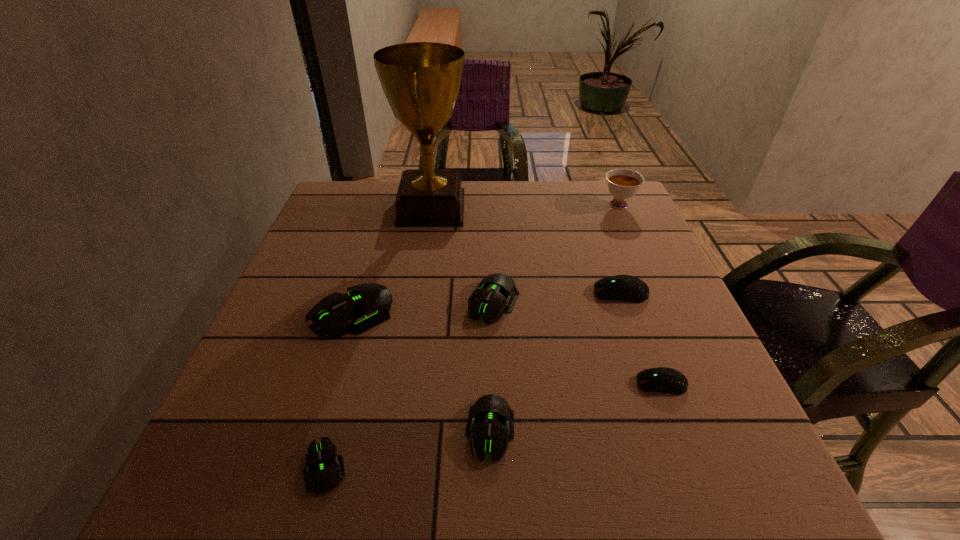
Identify the location of award. The width and height of the screenshot is (960, 540). (421, 80).

The image size is (960, 540). I want to click on gold award, so click(421, 80).

The image size is (960, 540). I want to click on white teacup, so click(x=622, y=184).

Image resolution: width=960 pixels, height=540 pixels. In order to click on the seventh shortest object in this screenshot , I will do `click(622, 184)`.

Identify the location of the biggest gray computer mouse. The image size is (960, 540). (367, 305).

Find the location of a particular element. Image resolution: width=960 pixels, height=540 pixels. the bigger dark computer equipment is located at coordinates (628, 288).

Locate an element on the screen. The image size is (960, 540). the third smallest gray computer mouse is located at coordinates (495, 293).

Identify the location of the smaller dark computer equipment. The image size is (960, 540). (661, 379).

In order to click on the third nearest object in this screenshot , I will do `click(661, 379)`.

Identify the location of the second smallest gray computer mouse. The image size is (960, 540). (490, 425).